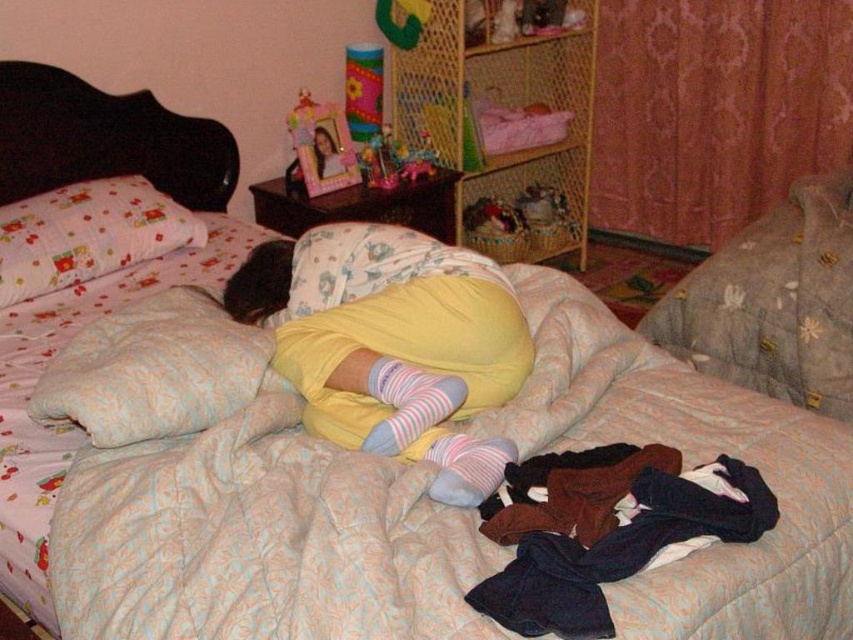
You are organizing your bedroom and want to place the yellow cotton shirt at center neatly on the wooden nightstand. However, there is already a matte plastic photo frame at upper center there. Where should you place the shirt relative to the frame to maintain the current arrangement?

The yellow cotton shirt at center should be placed to the right of the matte plastic photo frame at upper center to maintain the current arrangement.